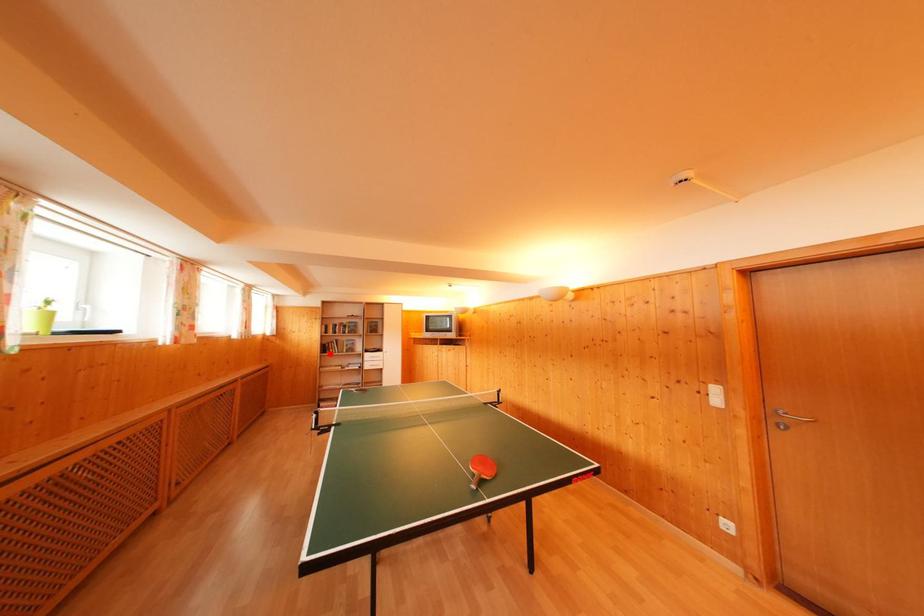
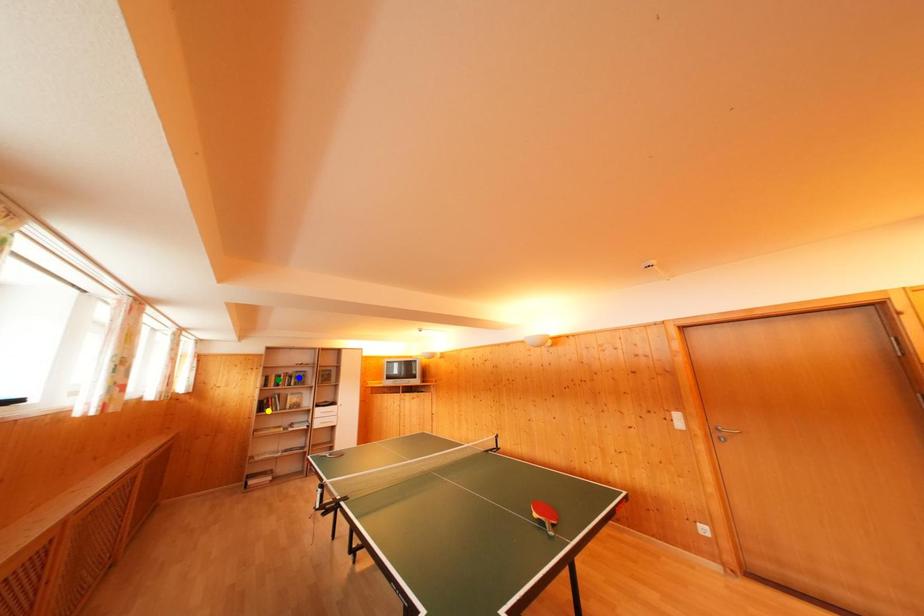
Question: I am providing you with two images of the same scene from different viewpoints. A red point is marked on the first image. You are given multiple points on the second image. Which spot in image 2 lines up with the point in image 1?

Choices:
 (A) blue point
 (B) yellow point
 (C) green point

Answer: (B)